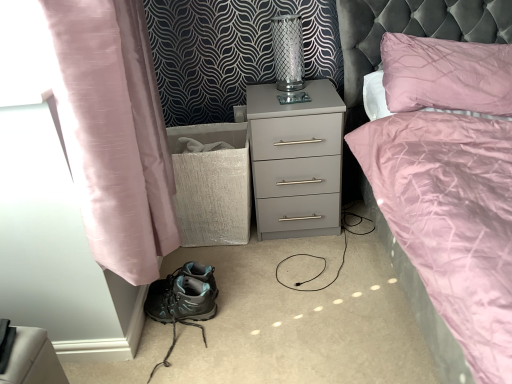
You are a GUI agent. You are given a task and a screenshot of the screen. Output one action in this format:
    pyautogui.click(x=<x>, y=<y>)
    Task: Click on the unoccupied space behind teal fabric hiking boots at lower left
    Image resolution: width=512 pixels, height=384 pixels.
    Given the screenshot: What is the action you would take?
    point(196,261)